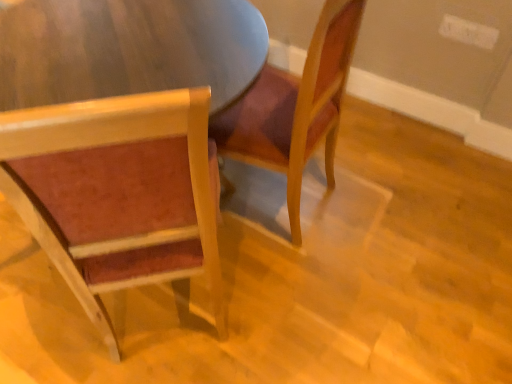
Question: Is matte wood chair at left, acting as the 2th chair starting from the right, facing towards velvet-like red chair at center, the first chair positioned from the right?

Choices:
 (A) yes
 (B) no

Answer: (B)

Question: Does matte wood chair at left, acting as the 2th chair starting from the right, have a greater width compared to velvet-like red chair at center, the first chair positioned from the right?

Choices:
 (A) yes
 (B) no

Answer: (A)

Question: Does matte wood chair at left, acting as the 1th chair starting from the left, touch velvet-like red chair at center, the 2th chair positioned from the left?

Choices:
 (A) no
 (B) yes

Answer: (A)

Question: From the image's perspective, is matte wood chair at left, acting as the 1th chair starting from the left, above velvet-like red chair at center, the 2th chair positioned from the left?

Choices:
 (A) no
 (B) yes

Answer: (A)

Question: From the image's perspective, is matte wood chair at left, acting as the 2th chair starting from the right, below velvet-like red chair at center, the first chair positioned from the right?

Choices:
 (A) no
 (B) yes

Answer: (B)

Question: Could velvet-like red chair at center, the first chair positioned from the right, be considered to be inside matte wood chair at left, acting as the 2th chair starting from the right?

Choices:
 (A) yes
 (B) no

Answer: (B)

Question: Is velvet-like red chair at center, the 2th chair positioned from the left, turned away from matte wood chair at left, acting as the 1th chair starting from the left?

Choices:
 (A) yes
 (B) no

Answer: (B)

Question: Can you confirm if velvet-like red chair at center, the first chair positioned from the right, is positioned to the left of matte wood chair at left, acting as the 1th chair starting from the left?

Choices:
 (A) no
 (B) yes

Answer: (A)

Question: Can you confirm if velvet-like red chair at center, the first chair positioned from the right, is positioned to the right of matte wood chair at left, acting as the 1th chair starting from the left?

Choices:
 (A) yes
 (B) no

Answer: (A)

Question: Considering the relative sizes of velvet-like red chair at center, the first chair positioned from the right, and matte wood chair at left, acting as the 2th chair starting from the right, in the image provided, is velvet-like red chair at center, the first chair positioned from the right, bigger than matte wood chair at left, acting as the 2th chair starting from the right,?

Choices:
 (A) no
 (B) yes

Answer: (A)

Question: Is velvet-like red chair at center, the 2th chair positioned from the left, wider than matte wood chair at left, acting as the 1th chair starting from the left?

Choices:
 (A) yes
 (B) no

Answer: (B)

Question: From a real-world perspective, is velvet-like red chair at center, the first chair positioned from the right, located higher than matte wood chair at left, acting as the 1th chair starting from the left?

Choices:
 (A) no
 (B) yes

Answer: (A)

Question: Considering the positions of matte wood chair at left, acting as the 2th chair starting from the right, and velvet-like red chair at center, the first chair positioned from the right, in the image, is matte wood chair at left, acting as the 2th chair starting from the right, taller or shorter than velvet-like red chair at center, the first chair positioned from the right,?

Choices:
 (A) short
 (B) tall

Answer: (B)